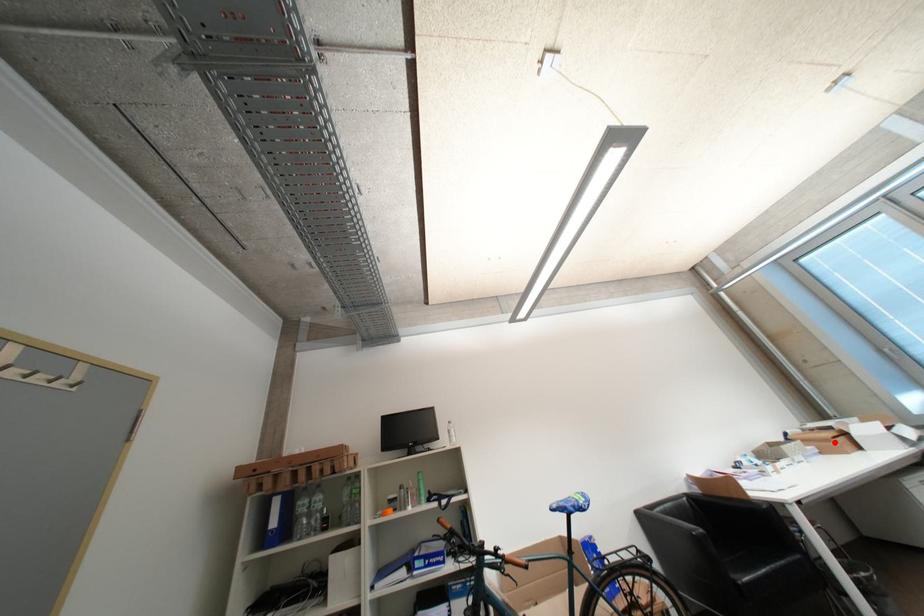
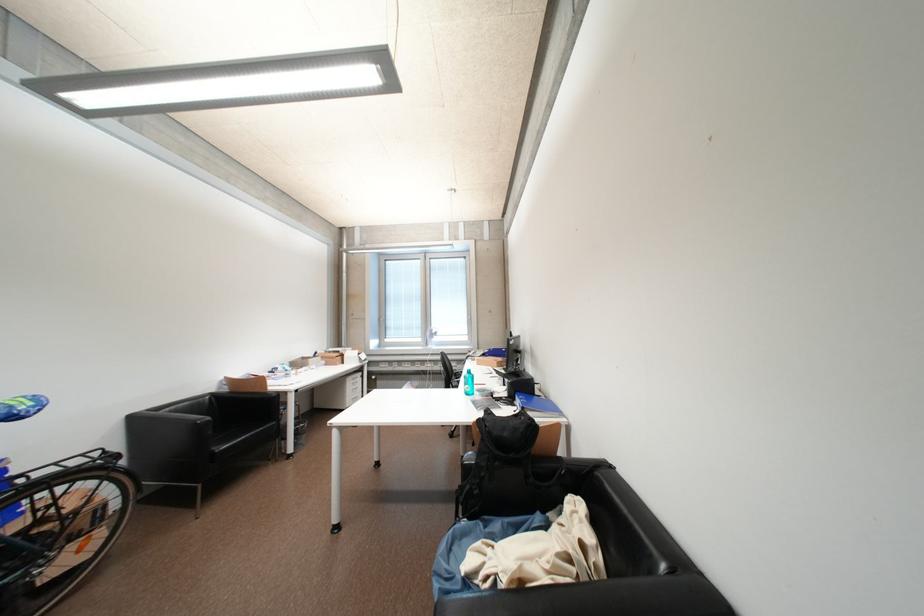
Question: I am providing you with two images of the same scene from different viewpoints. Image1 has a red point marked. In image2, the corresponding 3D location appears at what relative position? Reply with the corresponding letter.

Choices:
 (A) Closer
 (B) Farther

Answer: (B)